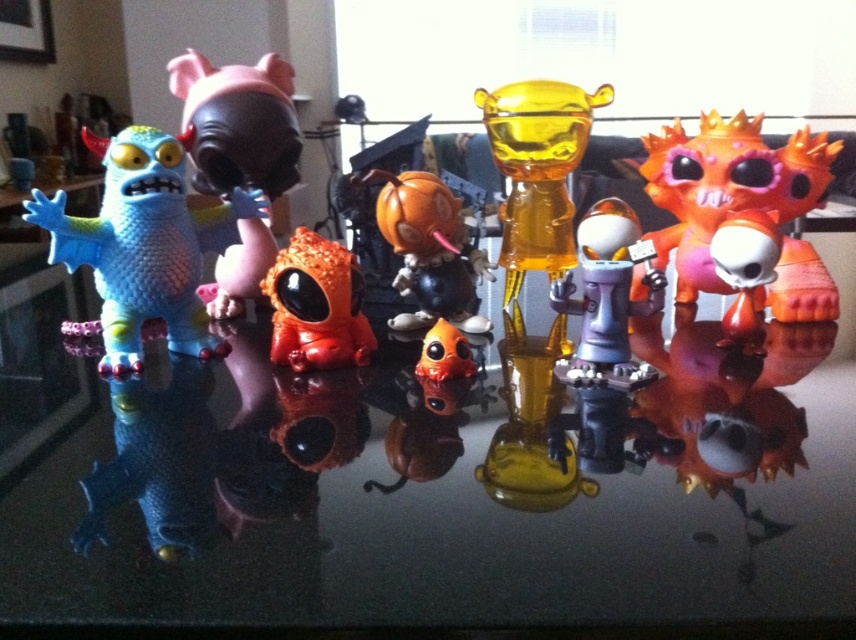
Is matte blue plush toy at left positioned behind orange glossy skull at center right?

No, matte blue plush toy at left is in front of orange glossy skull at center right.

Consider the image. Who is positioned more to the left, matte blue plush toy at left or orange glossy skull at center right?

matte blue plush toy at left

Find the location of `matte blue plush toy at left`. matte blue plush toy at left is located at coordinates click(144, 243).

Image resolution: width=856 pixels, height=640 pixels. Describe the element at coordinates (144, 243) in the screenshot. I see `matte blue plush toy at left` at that location.

This screenshot has width=856, height=640. I want to click on matte blue plush toy at left, so click(144, 243).

Can you confirm if orange glossy skull at center right is positioned to the right of metallic gray robot at center?

Correct, you'll find orange glossy skull at center right to the right of metallic gray robot at center.

Is point (681, 138) positioned behind point (651, 372)?

Yes.

Is point (640, 285) farther from viewer compared to point (611, 227)?

That is False.

The height and width of the screenshot is (640, 856). What are the coordinates of `orange glossy skull at center right` in the screenshot? It's located at (726, 188).